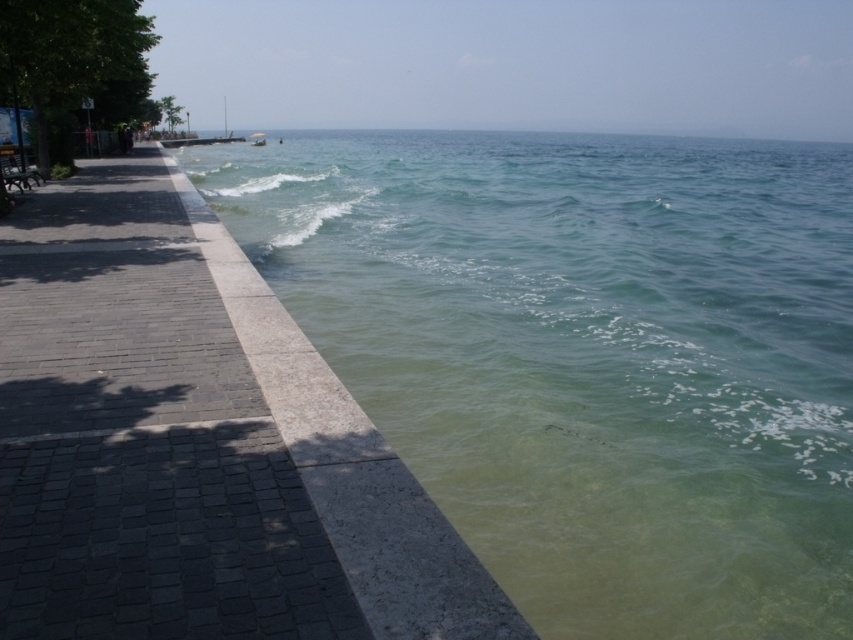
You are standing at the edge of the walkway on the left side of the image and want to locate the clear water at lower right. According to the coordinates provided, where exactly should you look to find it?

The clear water at lower right is located at point coordinates of (589, 355).

You are standing at the origin point of the coordinate system. You want to walk to the dark gray stone pavement at left. Which direction should you move in?

The dark gray stone pavement at left is located at coordinate point (141,435), so you should move towards the northeast direction to reach it.